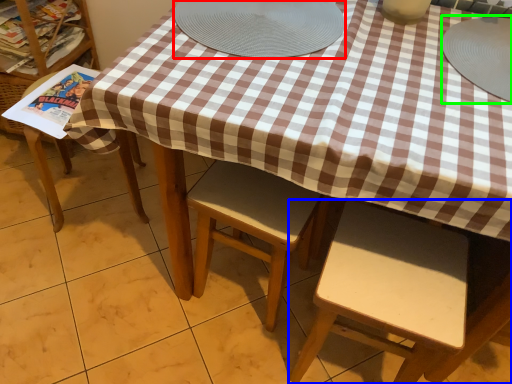
Question: Which is nearer to the platter (highlighted by a red box)? chair (highlighted by a blue box) or tableware (highlighted by a green box).

Choices:
 (A) chair
 (B) tableware

Answer: (B)